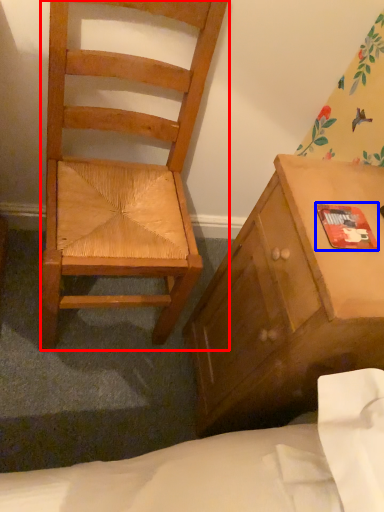
Question: Which of the following is the closest to the observer, chair (highlighted by a red box) or paperback book (highlighted by a blue box)?

Choices:
 (A) chair
 (B) paperback book

Answer: (A)